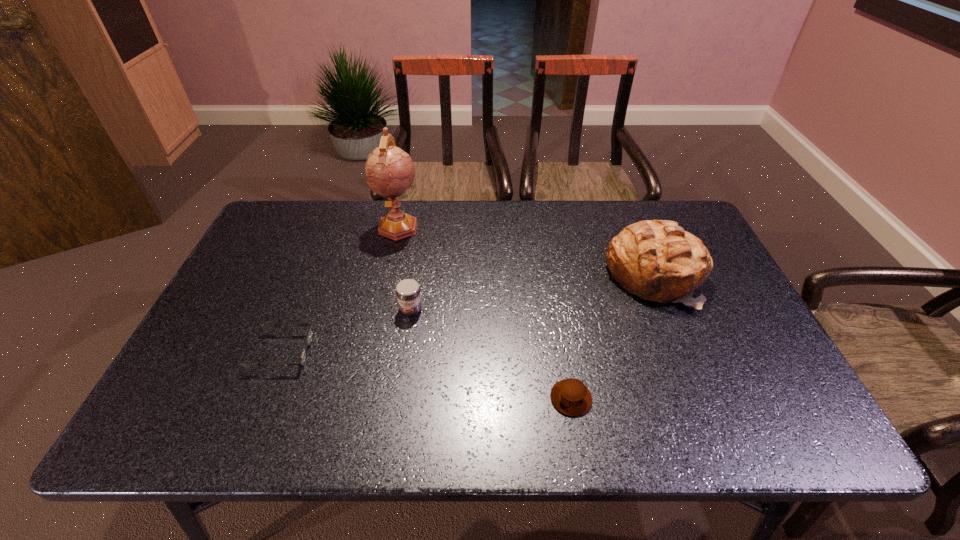
The width and height of the screenshot is (960, 540). I want to click on free spot that satisfies the following two spatial constraints: 1. on the front label of the third tallest object; 2. on the right side of the muffin, so click(x=397, y=398).

You are a GUI agent. You are given a task and a screenshot of the screen. Output one action in this format:
    pyautogui.click(x=<x>, y=<y>)
    Task: Click on the blank space that satisfies the following two spatial constraints: 1. on the front-facing side of the tallest object; 2. on the left side of the bread
    This screenshot has width=960, height=540.
    Given the screenshot: What is the action you would take?
    pyautogui.click(x=388, y=276)

Where is `free space that satisfies the following two spatial constraints: 1. on the front-facing side of the tallest object; 2. on the right side of the fourth tallest object`? The width and height of the screenshot is (960, 540). free space that satisfies the following two spatial constraints: 1. on the front-facing side of the tallest object; 2. on the right side of the fourth tallest object is located at coordinates (361, 398).